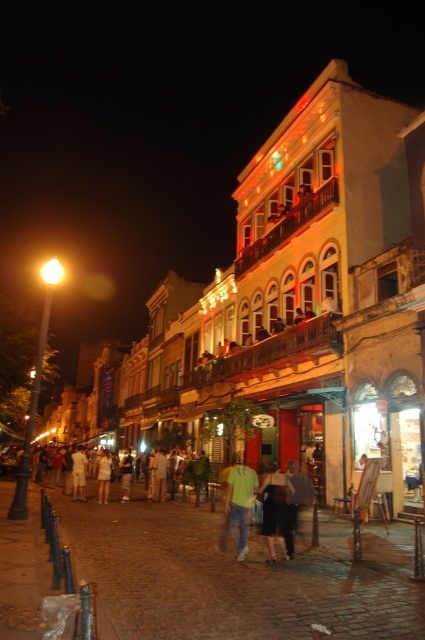
Question: Observing the image, what is the correct spatial positioning of light green t-shirt at center in reference to dark fabric dress at center?

Choices:
 (A) left
 (B) right

Answer: (A)

Question: Does light green t-shirt at center have a greater width compared to dark fabric dress at center?

Choices:
 (A) yes
 (B) no

Answer: (B)

Question: Can you confirm if light green t-shirt at center is bigger than dark fabric dress at center?

Choices:
 (A) yes
 (B) no

Answer: (A)

Question: Which point is closer to the camera?

Choices:
 (A) dark fabric dress at center
 (B) light green t-shirt at center

Answer: (A)

Question: Which of the following is the closest to the observer?

Choices:
 (A) dark fabric dress at center
 (B) light green t-shirt at center

Answer: (A)